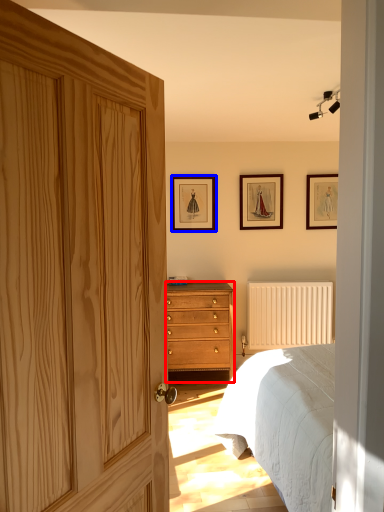
Question: Which object is closer to the camera taking this photo, chest of drawers (highlighted by a red box) or picture frame (highlighted by a blue box)?

Choices:
 (A) chest of drawers
 (B) picture frame

Answer: (A)